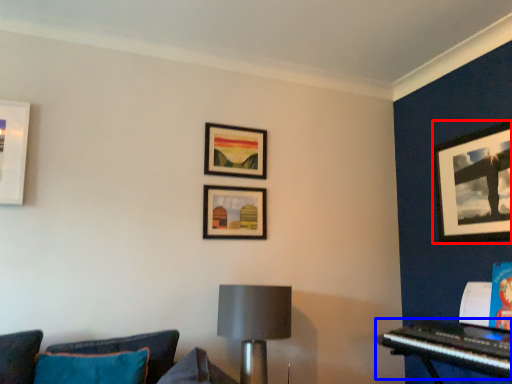
Question: Which object appears closest to the camera in this image, picture frame (highlighted by a red box) or piano (highlighted by a blue box)?

Choices:
 (A) picture frame
 (B) piano

Answer: (B)